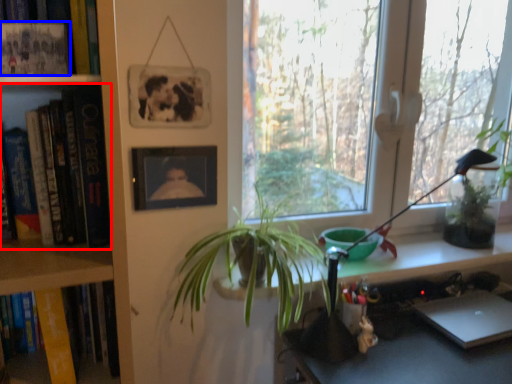
Question: Which object appears farthest to the camera in this image, book (highlighted by a red box) or book (highlighted by a blue box)?

Choices:
 (A) book
 (B) book

Answer: (A)